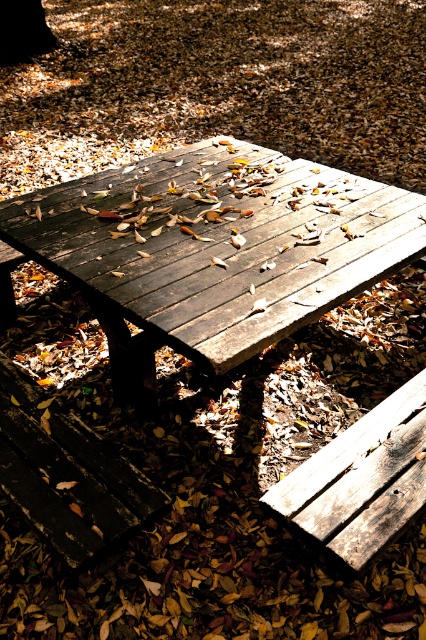
Is dark brown wood picnic table at center positioned behind wooden bench at lower right?

Yes, it is.

Is point (198, 356) in front of point (357, 458)?

Yes, point (198, 356) is in front of point (357, 458).

Locate an element on the screen. The image size is (426, 640). dark brown wood picnic table at center is located at coordinates (213, 250).

Is dark brown wood picnic table at center above dark brown wood bench at lower left?

Indeed, dark brown wood picnic table at center is positioned over dark brown wood bench at lower left.

Which is in front, point (247, 208) or point (31, 380)?

Point (31, 380) is in front.

Where is `dark brown wood picnic table at center`? This screenshot has height=640, width=426. dark brown wood picnic table at center is located at coordinates (213, 250).

In the scene shown: Who is shorter, dark brown wood bench at lower left or wooden bench at lower right?

With less height is wooden bench at lower right.

Which of these two, dark brown wood bench at lower left or wooden bench at lower right, stands taller?

dark brown wood bench at lower left is taller.

Is point (31, 406) in front of point (386, 534)?

No, it is behind (386, 534).

At what (x,y) coordinates should I click in order to perform the action: click on dark brown wood bench at lower left. Please return your answer as a coordinate pair (x, y). Looking at the image, I should click on (66, 472).